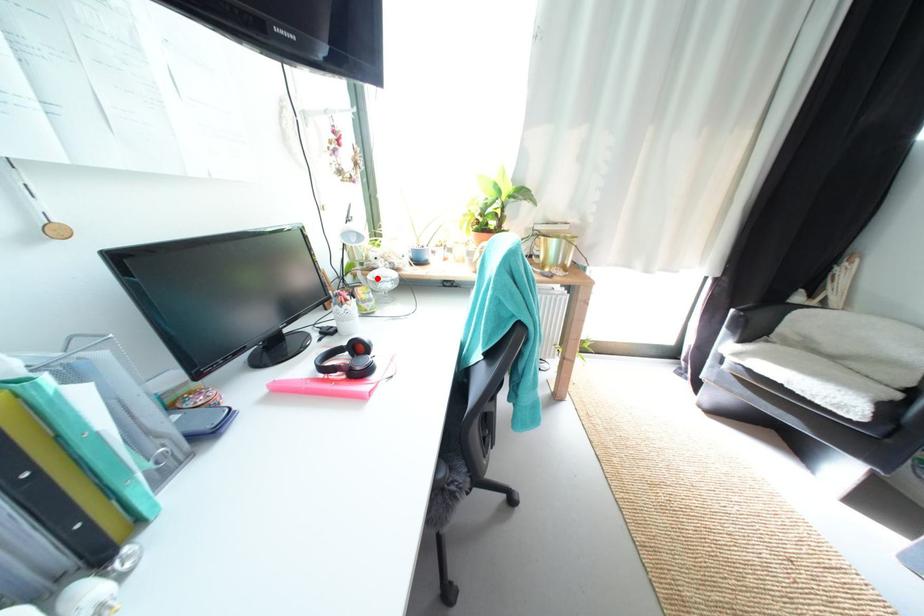
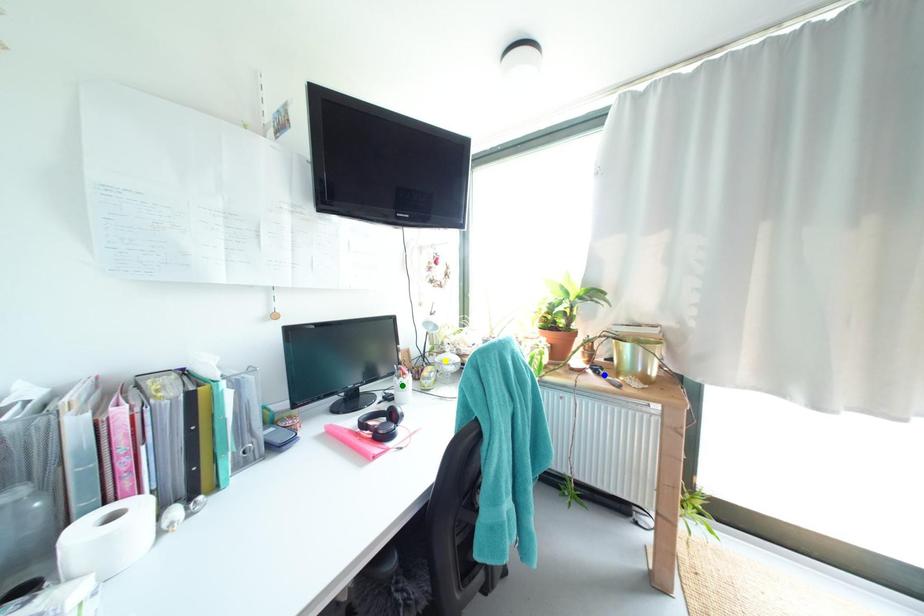
Question: I am providing you with two images of the same scene from different viewpoints. A red point is marked on the first image. You are given multiple points on the second image. Which spot in image 2 lines up with the point in image 1?

Choices:
 (A) green point
 (B) blue point
 (C) yellow point

Answer: (C)